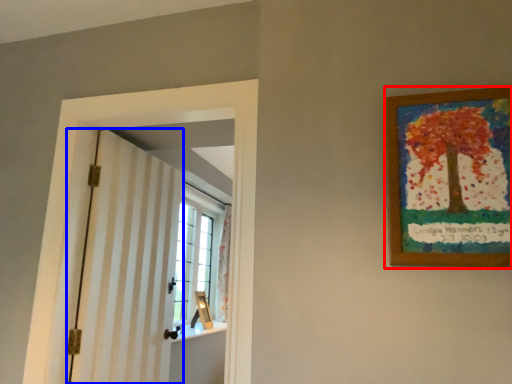
Question: Among these objects, which one is nearest to the camera, picture frame (highlighted by a red box) or barn door (highlighted by a blue box)?

Choices:
 (A) picture frame
 (B) barn door

Answer: (A)